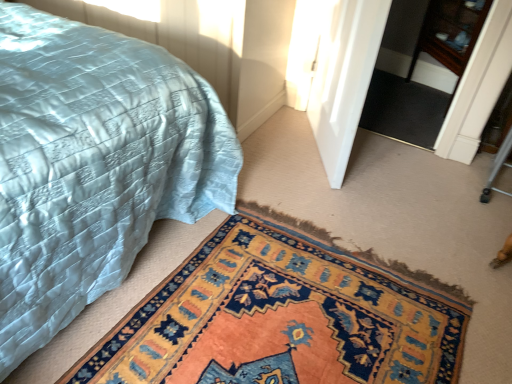
Locate an element on the screen. The width and height of the screenshot is (512, 384). vacant area that is in front of white glossy door at center is located at coordinates (330, 198).